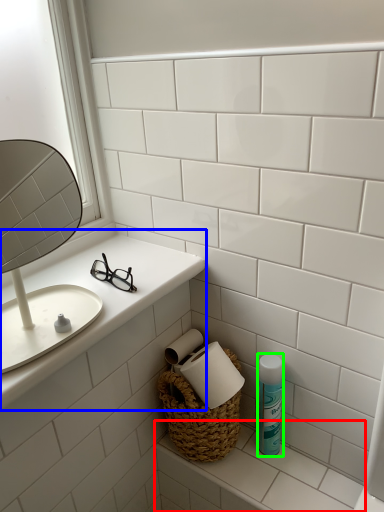
Question: Which object is the closest to the counter top (highlighted by a red box)? Choose among these: counter top (highlighted by a blue box) or mouthwash (highlighted by a green box).

Choices:
 (A) counter top
 (B) mouthwash

Answer: (B)